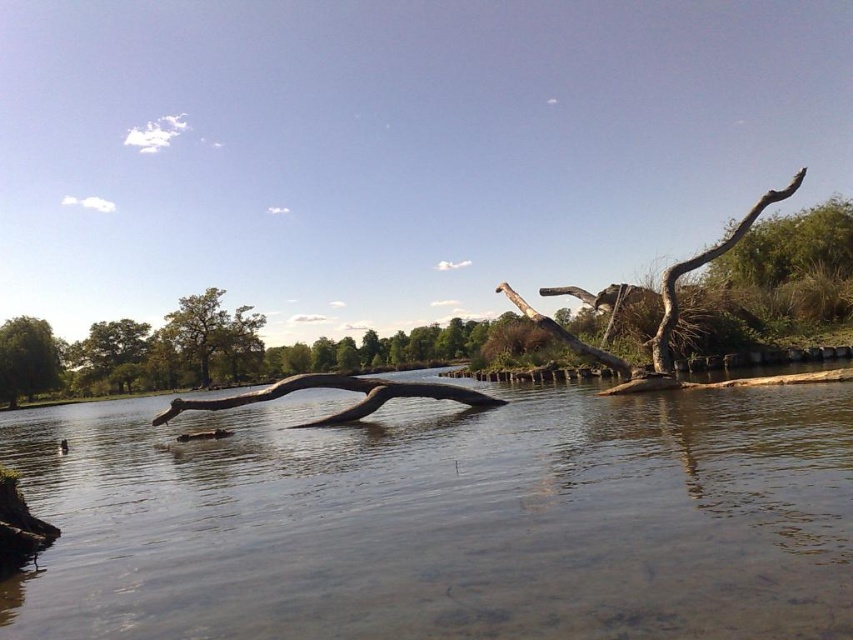
Can you confirm if brown wood river at center is positioned above green leafy tree at left?

Yes, brown wood river at center is above green leafy tree at left.

Between brown wood river at center and green leafy tree at left, which one has less height?

brown wood river at center

Locate an element on the screen. brown wood river at center is located at coordinates (444, 518).

Between brown wood river at center and green matte tree at left, which one appears on the left side from the viewer's perspective?

Positioned to the left is green matte tree at left.

What do you see at coordinates (444, 518) in the screenshot? I see `brown wood river at center` at bounding box center [444, 518].

You are a GUI agent. You are given a task and a screenshot of the screen. Output one action in this format:
    pyautogui.click(x=<x>, y=<y>)
    Task: Click on the brown wood river at center
    This screenshot has width=853, height=640.
    Given the screenshot: What is the action you would take?
    pyautogui.click(x=444, y=518)

Which is above, green matte tree at upper left or green leafy tree at left?

green matte tree at upper left is above.

Does green matte tree at upper left appear on the right side of green leafy tree at left?

Yes, green matte tree at upper left is to the right of green leafy tree at left.

Find the location of a particular element. Image resolution: width=853 pixels, height=640 pixels. green matte tree at upper left is located at coordinates (212, 332).